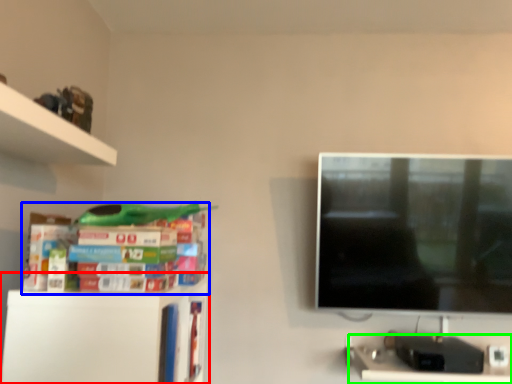
Question: Which object is positioned closest to shelf (highlighted by a red box)? Select from book (highlighted by a blue box) and computer desk (highlighted by a green box).

Choices:
 (A) book
 (B) computer desk

Answer: (A)